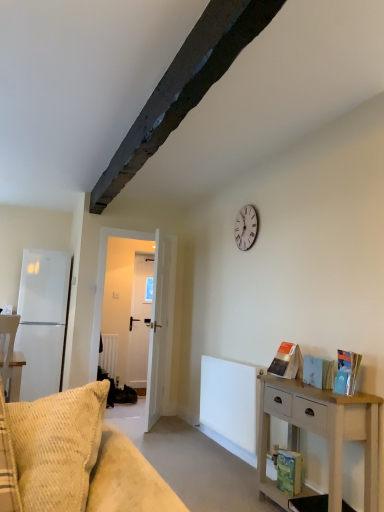
Image resolution: width=384 pixels, height=512 pixels. What are the coordinates of `space that is in front of white paper book at right, the third book in the bottom-to-top sequence` in the screenshot? It's located at (322, 393).